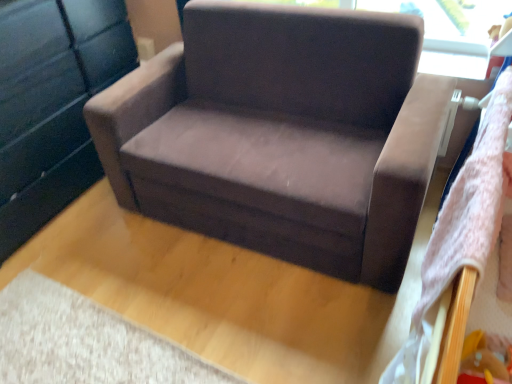
Question: Considering the relative positions of matte black dresser at left and suede-like brown armchair at center in the image provided, is matte black dresser at left behind suede-like brown armchair at center?

Choices:
 (A) no
 (B) yes

Answer: (B)

Question: From a real-world perspective, is matte black dresser at left physically below suede-like brown armchair at center?

Choices:
 (A) yes
 (B) no

Answer: (B)

Question: Could you tell me if matte black dresser at left is turned towards suede-like brown armchair at center?

Choices:
 (A) no
 (B) yes

Answer: (B)

Question: Does matte black dresser at left appear on the right side of suede-like brown armchair at center?

Choices:
 (A) yes
 (B) no

Answer: (B)

Question: Considering the relative sizes of matte black dresser at left and suede-like brown armchair at center in the image provided, is matte black dresser at left bigger than suede-like brown armchair at center?

Choices:
 (A) yes
 (B) no

Answer: (B)

Question: Is matte black dresser at left positioned in front of suede-like brown armchair at center?

Choices:
 (A) no
 (B) yes

Answer: (A)

Question: Does suede-like brown armchair at center have a larger size compared to matte black dresser at left?

Choices:
 (A) no
 (B) yes

Answer: (B)

Question: Is suede-like brown armchair at center aimed at matte black dresser at left?

Choices:
 (A) no
 (B) yes

Answer: (A)

Question: Does suede-like brown armchair at center have a lesser height compared to matte black dresser at left?

Choices:
 (A) no
 (B) yes

Answer: (B)

Question: Is suede-like brown armchair at center turned away from matte black dresser at left?

Choices:
 (A) no
 (B) yes

Answer: (A)

Question: Is suede-like brown armchair at center positioned beyond the bounds of matte black dresser at left?

Choices:
 (A) no
 (B) yes

Answer: (B)

Question: Is suede-like brown armchair at center wider than matte black dresser at left?

Choices:
 (A) no
 (B) yes

Answer: (B)

Question: From the image's perspective, is matte black dresser at left located above or below suede-like brown armchair at center?

Choices:
 (A) below
 (B) above

Answer: (B)